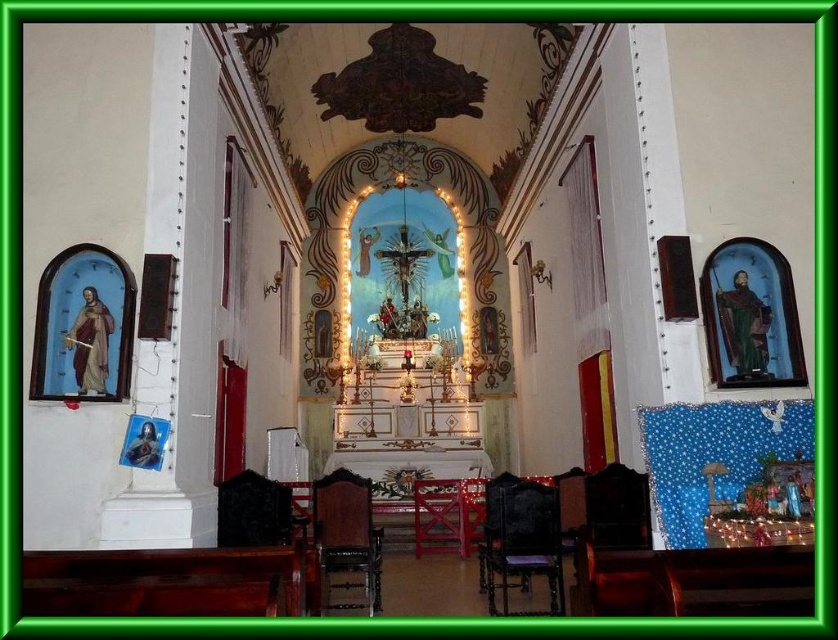
Can you confirm if dark brown polished wood church bench at lower left is taller than black leather chair at lower center?

Yes, dark brown polished wood church bench at lower left is taller than black leather chair at lower center.

Which is in front, point (197, 554) or point (267, 504)?

Positioned in front is point (197, 554).

Is point (285, 557) behind point (247, 488)?

No, (285, 557) is closer to viewer.

The image size is (838, 640). Find the location of `dark brown polished wood church bench at lower left`. dark brown polished wood church bench at lower left is located at coordinates (168, 582).

Can you confirm if dark wood chair at lower right is thinner than black leather chair at lower center?

In fact, dark wood chair at lower right might be wider than black leather chair at lower center.

In the scene shown: Which is more to the left, dark wood chair at lower right or black leather chair at lower center?

From the viewer's perspective, black leather chair at lower center appears more on the left side.

Where is `dark wood chair at lower right`? dark wood chair at lower right is located at coordinates (520, 541).

You are a GUI agent. You are given a task and a screenshot of the screen. Output one action in this format:
    pyautogui.click(x=<x>, y=<y>)
    Task: Click on the dark wood chair at lower right
    
    Given the screenshot: What is the action you would take?
    pyautogui.click(x=520, y=541)

Which is behind, point (189, 614) or point (380, 570)?

The point (380, 570) is more distant.

From the picture: Who is positioned more to the left, dark brown polished wood church bench at lower left or wooden polished chair at center?

Positioned to the left is dark brown polished wood church bench at lower left.

Between point (190, 595) and point (335, 474), which one is positioned behind?

The point (335, 474) is more distant.

Locate an element on the screen. The image size is (838, 640). dark brown polished wood church bench at lower left is located at coordinates (168, 582).